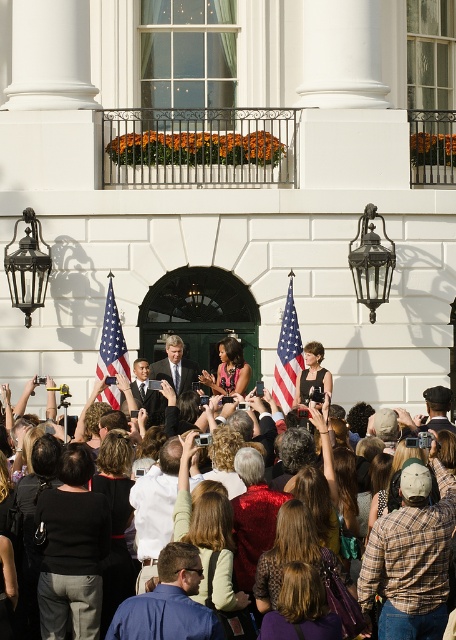
Who is lower down, multicolored clothing at center or dark suit at center?

Positioned lower is multicolored clothing at center.

Can you confirm if multicolored clothing at center is positioned to the left of dark suit at center?

In fact, multicolored clothing at center is to the right of dark suit at center.

Is point (424, 515) in front of point (140, 358)?

Yes, it is in front of point (140, 358).

This screenshot has width=456, height=640. I want to click on multicolored clothing at center, so click(414, 552).

Can you confirm if plaid shirt at center is wider than matte american flag at center?

In fact, plaid shirt at center might be narrower than matte american flag at center.

Is point (407, 506) closer to camera compared to point (125, 365)?

Yes, point (407, 506) is closer to viewer.

You are a GUI agent. You are given a task and a screenshot of the screen. Output one action in this format:
    pyautogui.click(x=<x>, y=<y>)
    Task: Click on the plaid shirt at center
    The height and width of the screenshot is (640, 456).
    Given the screenshot: What is the action you would take?
    pyautogui.click(x=412, y=557)

Who is positioned more to the right, blue shirt at lower center or dark suit at center?

blue shirt at lower center

Who is positioned more to the left, blue shirt at lower center or dark suit at center?

dark suit at center is more to the left.

Is point (214, 627) more distant than point (144, 364)?

No.

The height and width of the screenshot is (640, 456). What are the coordinates of `blue shirt at lower center` in the screenshot? It's located at (167, 602).